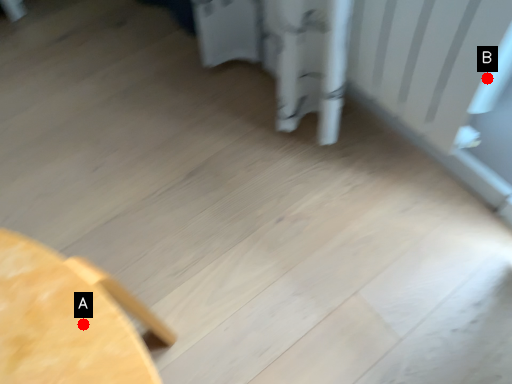
Question: Two points are circled on the image, labeled by A and B beside each circle. Which point is closer to the camera?

Choices:
 (A) A is closer
 (B) B is closer

Answer: (A)